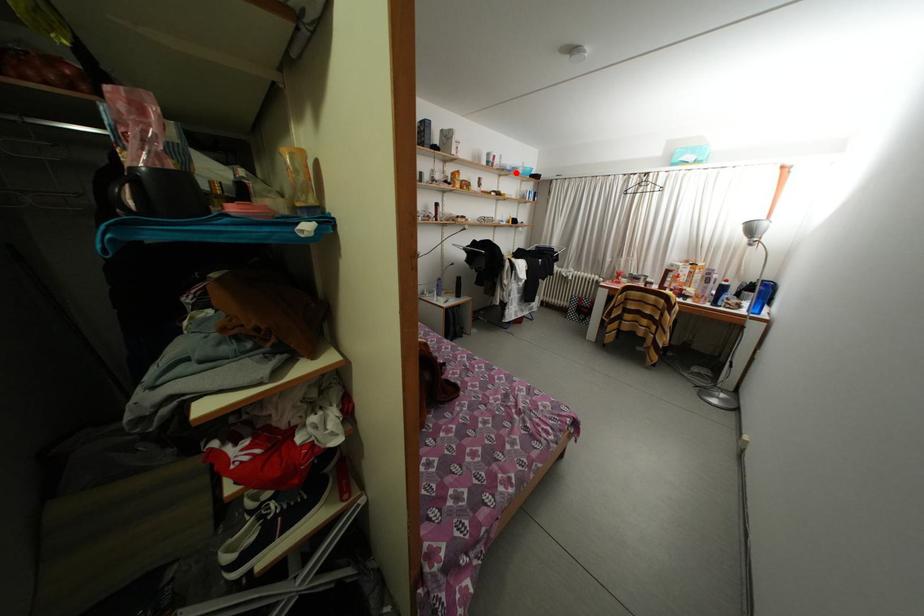
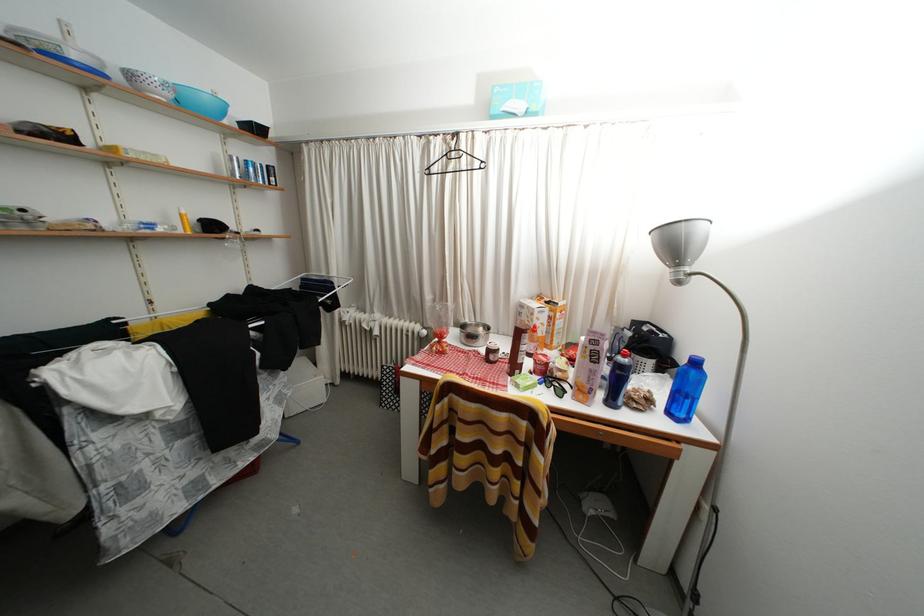
Question: I am providing you with two images of the same scene from different viewpoints. In image1, a red point is highlighted. Considering the same 3D point in image2, which of the following is correct?

Choices:
 (A) It is closer
 (B) It is farther

Answer: (B)